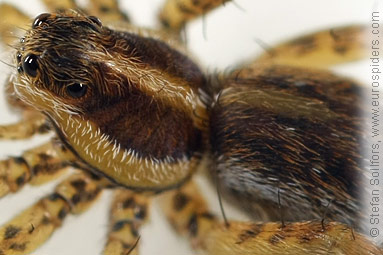
Find the location of a particular element. Image resolution: width=383 pixels, height=255 pixels. white floor is located at coordinates (237, 31).